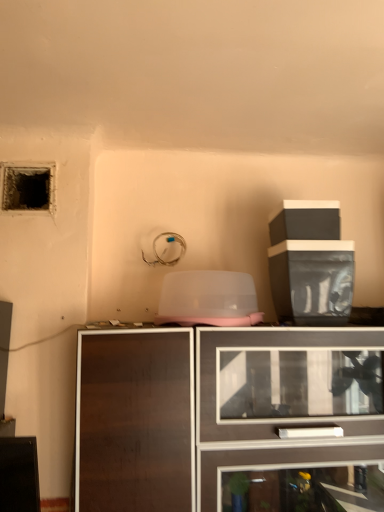
In order to face black plastic container at upper right, placed as the 1th cabinetry when sorted from top to bottom, should I rotate leftwards or rightwards?

You should look right and rotate roughly 15.015 degrees.

Describe the element at coordinates (312, 280) in the screenshot. The height and width of the screenshot is (512, 384). I see `black plastic container at upper right, placed as the 1th cabinetry when sorted from top to bottom` at that location.

Locate an element on the screen. dark wood cabinet at center, the 1th cabinetry when ordered from bottom to top is located at coordinates (227, 416).

Considering the relative sizes of dark textured hole at upper left and dark wood cabinet at center, the second cabinetry positioned from the top, in the image provided, is dark textured hole at upper left smaller than dark wood cabinet at center, the second cabinetry positioned from the top,?

Yes, dark textured hole at upper left is smaller than dark wood cabinet at center, the second cabinetry positioned from the top.

Between dark textured hole at upper left and dark wood cabinet at center, the second cabinetry positioned from the top, which one has smaller width?

With smaller width is dark textured hole at upper left.

Relative to dark wood cabinet at center, the second cabinetry positioned from the top, is dark textured hole at upper left in front or behind?

Clearly, dark textured hole at upper left is behind dark wood cabinet at center, the second cabinetry positioned from the top.

From the image's perspective, is dark textured hole at upper left positioned above or below dark wood cabinet at center, the second cabinetry positioned from the top?

Based on their image positions, dark textured hole at upper left is located above dark wood cabinet at center, the second cabinetry positioned from the top.

Can you confirm if dark wood cabinet at center, the 1th cabinetry when ordered from bottom to top, is shorter than dark textured hole at upper left?

No.

Is dark wood cabinet at center, the 1th cabinetry when ordered from bottom to top, bigger than dark textured hole at upper left?

Correct, dark wood cabinet at center, the 1th cabinetry when ordered from bottom to top, is larger in size than dark textured hole at upper left.

Looking at their sizes, would you say dark wood cabinet at center, the second cabinetry positioned from the top, is wider or thinner than dark textured hole at upper left?

In the image, dark wood cabinet at center, the second cabinetry positioned from the top, appears to be wider than dark textured hole at upper left.

From a real-world perspective, which object stands above the other?

From a 3D spatial view, black plastic container at upper right, acting as the 2th cabinetry starting from the bottom, is above.

Locate an element on the screen. This screenshot has height=512, width=384. cabinetry in front of the black plastic container at upper right, placed as the 1th cabinetry when sorted from top to bottom is located at coordinates (227, 416).

Is black plastic container at upper right, placed as the 1th cabinetry when sorted from top to bottom, far from dark wood cabinet at center, the 1th cabinetry when ordered from bottom to top?

No, black plastic container at upper right, placed as the 1th cabinetry when sorted from top to bottom, is not far from dark wood cabinet at center, the 1th cabinetry when ordered from bottom to top.

Can you tell me how much black plastic container at upper right, placed as the 1th cabinetry when sorted from top to bottom, and dark wood cabinet at center, the 1th cabinetry when ordered from bottom to top, differ in facing direction?

They differ by 3.18 degrees in their facing directions.

In the scene shown: Can you confirm if dark textured hole at upper left is smaller than black plastic container at upper right, acting as the 2th cabinetry starting from the bottom?

Yes.

Is dark textured hole at upper left positioned far away from black plastic container at upper right, acting as the 2th cabinetry starting from the bottom?

No, dark textured hole at upper left is not far away from black plastic container at upper right, acting as the 2th cabinetry starting from the bottom.

Is black plastic container at upper right, placed as the 1th cabinetry when sorted from top to bottom, completely or partially inside dark textured hole at upper left?

No.

Looking at this image, which of these two, dark textured hole at upper left or black plastic container at upper right, acting as the 2th cabinetry starting from the bottom, stands taller?

black plastic container at upper right, acting as the 2th cabinetry starting from the bottom.

Could black plastic container at upper right, acting as the 2th cabinetry starting from the bottom, be considered to be inside dark wood cabinet at center, the 1th cabinetry when ordered from bottom to top?

Actually, black plastic container at upper right, acting as the 2th cabinetry starting from the bottom, is outside dark wood cabinet at center, the 1th cabinetry when ordered from bottom to top.

Considering the relative sizes of dark wood cabinet at center, the second cabinetry positioned from the top, and black plastic container at upper right, acting as the 2th cabinetry starting from the bottom, in the image provided, is dark wood cabinet at center, the second cabinetry positioned from the top, taller than black plastic container at upper right, acting as the 2th cabinetry starting from the bottom,?

Correct, dark wood cabinet at center, the second cabinetry positioned from the top, is much taller as black plastic container at upper right, acting as the 2th cabinetry starting from the bottom.

Is dark wood cabinet at center, the second cabinetry positioned from the top, far away from black plastic container at upper right, acting as the 2th cabinetry starting from the bottom?

No, dark wood cabinet at center, the second cabinetry positioned from the top, is not far from black plastic container at upper right, acting as the 2th cabinetry starting from the bottom.

From a real-world perspective, is dark wood cabinet at center, the 1th cabinetry when ordered from bottom to top, on top of black plastic container at upper right, placed as the 1th cabinetry when sorted from top to bottom?

No, from a real-world perspective, dark wood cabinet at center, the 1th cabinetry when ordered from bottom to top, is not over black plastic container at upper right, placed as the 1th cabinetry when sorted from top to bottom

Is black plastic container at upper right, placed as the 1th cabinetry when sorted from top to bottom, positioned with its back to dark textured hole at upper left?

That's not correct — black plastic container at upper right, placed as the 1th cabinetry when sorted from top to bottom, is not looking away from dark textured hole at upper left.

Based on the photo, considering the sizes of black plastic container at upper right, acting as the 2th cabinetry starting from the bottom, and dark textured hole at upper left in the image, is black plastic container at upper right, acting as the 2th cabinetry starting from the bottom, wider or thinner than dark textured hole at upper left?

In the image, black plastic container at upper right, acting as the 2th cabinetry starting from the bottom, appears to be wider than dark textured hole at upper left.

Looking at this image, from a real-world perspective, is black plastic container at upper right, acting as the 2th cabinetry starting from the bottom, below dark textured hole at upper left?

Yes, from a real-world perspective, black plastic container at upper right, acting as the 2th cabinetry starting from the bottom, is beneath dark textured hole at upper left.

Starting from the dark textured hole at upper left, which cabinetry is the 2nd one in front? Please provide its 2D coordinates.

[(227, 416)]

This screenshot has width=384, height=512. In the image, there is a dark wood cabinet at center, the second cabinetry positioned from the top. Find the location of `hole above it (from the image's perspective)`. hole above it (from the image's perspective) is located at coordinates (26, 188).

Based on their spatial positions, is black plastic container at upper right, placed as the 1th cabinetry when sorted from top to bottom, or dark textured hole at upper left closer to dark wood cabinet at center, the second cabinetry positioned from the top?

Based on the image, black plastic container at upper right, placed as the 1th cabinetry when sorted from top to bottom, appears to be nearer to dark wood cabinet at center, the second cabinetry positioned from the top.

From the image, which object appears to be farther from dark wood cabinet at center, the 1th cabinetry when ordered from bottom to top, dark textured hole at upper left or black plastic container at upper right, acting as the 2th cabinetry starting from the bottom?

Among the two, dark textured hole at upper left is located further to dark wood cabinet at center, the 1th cabinetry when ordered from bottom to top.

Looking at this image, from the image, which object appears to be nearer to black plastic container at upper right, placed as the 1th cabinetry when sorted from top to bottom, dark textured hole at upper left or dark wood cabinet at center, the 1th cabinetry when ordered from bottom to top?

dark wood cabinet at center, the 1th cabinetry when ordered from bottom to top, lies closer to black plastic container at upper right, placed as the 1th cabinetry when sorted from top to bottom, than the other object.

Considering their positions, is black plastic container at upper right, placed as the 1th cabinetry when sorted from top to bottom, positioned closer to dark textured hole at upper left than dark wood cabinet at center, the second cabinetry positioned from the top?

The object closer to dark textured hole at upper left is black plastic container at upper right, placed as the 1th cabinetry when sorted from top to bottom.

Estimate the real-world distances between objects in this image. Which object is further from dark textured hole at upper left, dark wood cabinet at center, the 1th cabinetry when ordered from bottom to top, or black plastic container at upper right, acting as the 2th cabinetry starting from the bottom?

dark wood cabinet at center, the 1th cabinetry when ordered from bottom to top, is positioned further to the anchor dark textured hole at upper left.

Based on their spatial positions, is dark wood cabinet at center, the 1th cabinetry when ordered from bottom to top, or dark textured hole at upper left further from black plastic container at upper right, placed as the 1th cabinetry when sorted from top to bottom?

The object further to black plastic container at upper right, placed as the 1th cabinetry when sorted from top to bottom, is dark textured hole at upper left.

This screenshot has height=512, width=384. I want to click on cabinetry located between dark textured hole at upper left and black plastic container at upper right, placed as the 1th cabinetry when sorted from top to bottom, in the left-right direction, so click(227, 416).